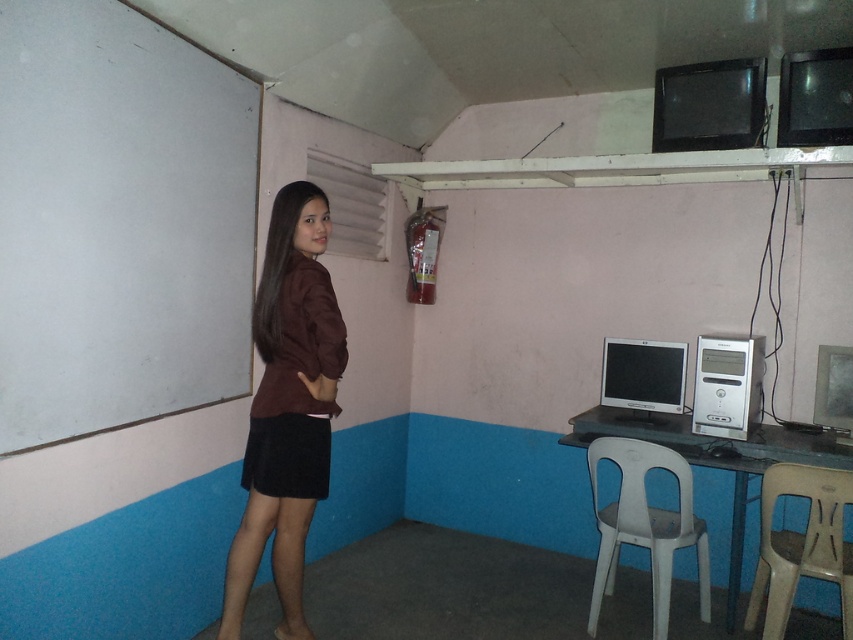
You are sitting in the beige plastic chair at lower right and want to reach the matte black monitor at right. Is the monitor located in front of you or behind you?

The beige plastic chair at lower right is closer to the viewer than the matte black monitor at right, so the monitor is behind you.

You are a student trying to sit down in the room. You see the brown matte skirt at lower left and the beige plastic chair at lower right. Which object is wider, and could the chair still be usable if the skirt is blocking part of it?

The brown matte skirt at lower left might be wider than beige plastic chair at lower right. However, the chair itself is designed for sitting, so even if the skirt is wider, as long as part of the chair remains accessible, it should still be usable.

Based on the photo, you are a student sitting on the beige plastic chair at lower right and want to reach the brown matte skirt at lower left. Is the skirt to your left or right side?

The brown matte skirt at lower left is positioned on the left side of the beige plastic chair at lower right, so from your perspective sitting on the chair, the skirt is to your left side.